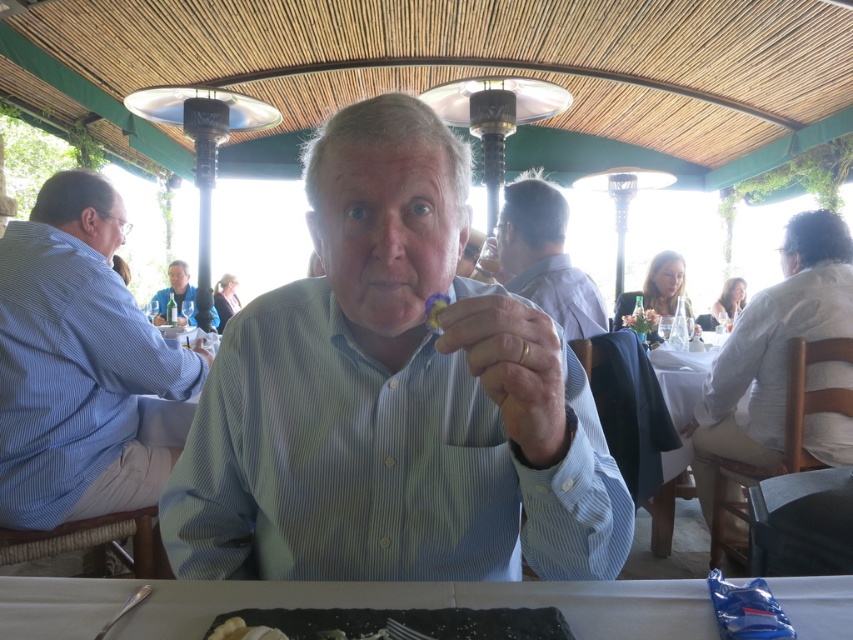
Is point (473, 227) behind point (647, 314)?

That is False.

Is matte plastic ring at center closer to the viewer compared to green leafy salad at center?

Yes, matte plastic ring at center is closer to the viewer.

Between point (473, 273) and point (635, 310), which one is positioned behind?

The point (635, 310) is more distant.

Where is `matte plastic ring at center`? The image size is (853, 640). matte plastic ring at center is located at coordinates (473, 259).

Does blue striped shirt at left appear on the left side of light brown shirt at center?

Correct, you'll find blue striped shirt at left to the left of light brown shirt at center.

Is blue striped shirt at left closer to camera compared to light brown shirt at center?

Yes, blue striped shirt at left is closer to the viewer.

I want to click on blue striped shirt at left, so click(x=82, y=365).

Is blue striped shirt at left bigger than white glossy table at lower center?

Correct, blue striped shirt at left is larger in size than white glossy table at lower center.

Is blue striped shirt at left wider than white glossy table at lower center?

Incorrect, blue striped shirt at left's width does not surpass white glossy table at lower center's.

Who is more distant from viewer, (135,452) or (846,620)?

The point (135,452) is behind.

Identify the location of blue striped shirt at left. This screenshot has width=853, height=640. (82, 365).